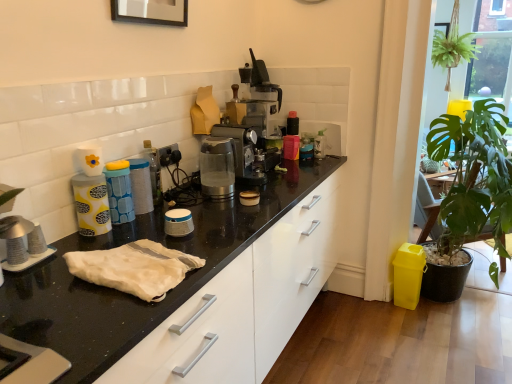
Question: Based on their positions, is transparent plastic coffee machine at center, the 2th coffee machine in the back-to-front sequence, located to the left or right of white fabric at center?

Choices:
 (A) left
 (B) right

Answer: (B)

Question: In terms of height, does transparent plastic coffee machine at center, the 2th coffee machine in the back-to-front sequence, look taller or shorter compared to white fabric at center?

Choices:
 (A) short
 (B) tall

Answer: (B)

Question: Which of these objects is positioned closest to the green leafy plant at upper right?

Choices:
 (A) transparent plastic coffee machine at center, the 2th coffee machine in the back-to-front sequence
 (B) satin silver coffee machine at center, arranged as the 1th coffee machine when viewed from the back
 (C) white fabric at center
 (D) green leafy plant at right

Answer: (D)

Question: Based on their relative distances, which object is farther from the transparent plastic coffee machine at center, positioned as the first coffee machine in front-to-back order?

Choices:
 (A) green leafy plant at right
 (B) satin silver coffee machine at center, which is the second coffee machine from front to back
 (C) green leafy plant at upper right
 (D) white fabric at center

Answer: (C)